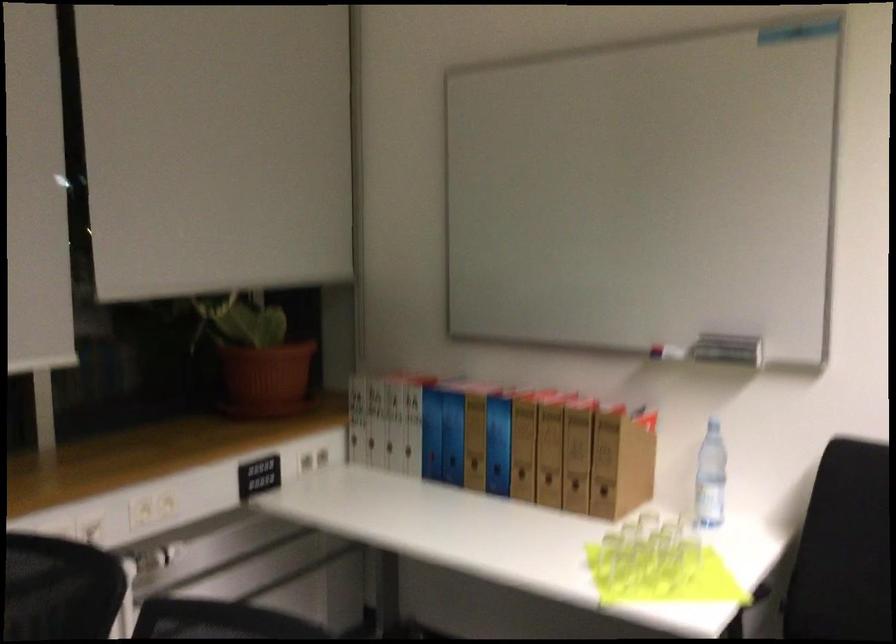
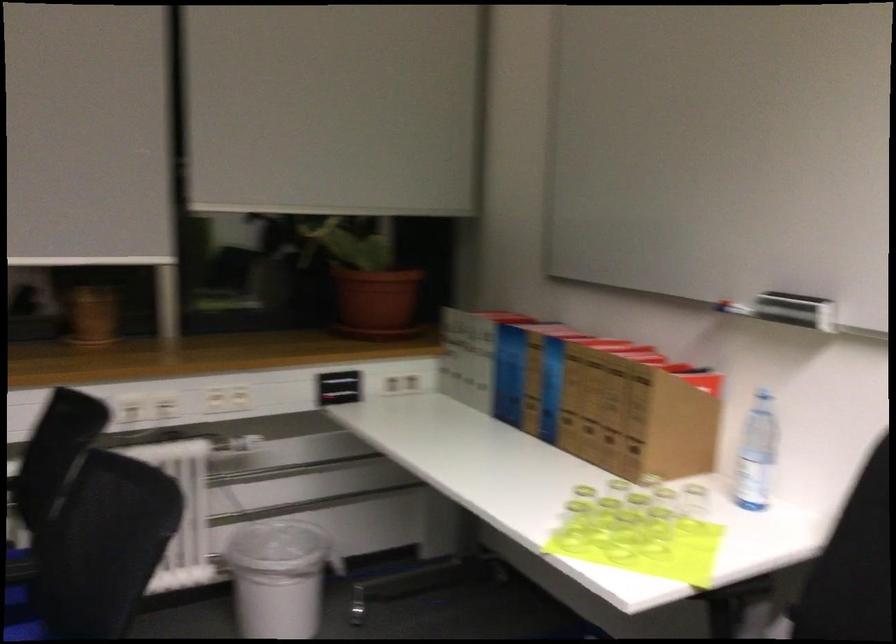
In the second image, find the point that corresponds to pixel 279 381 in the first image.

(375, 303)